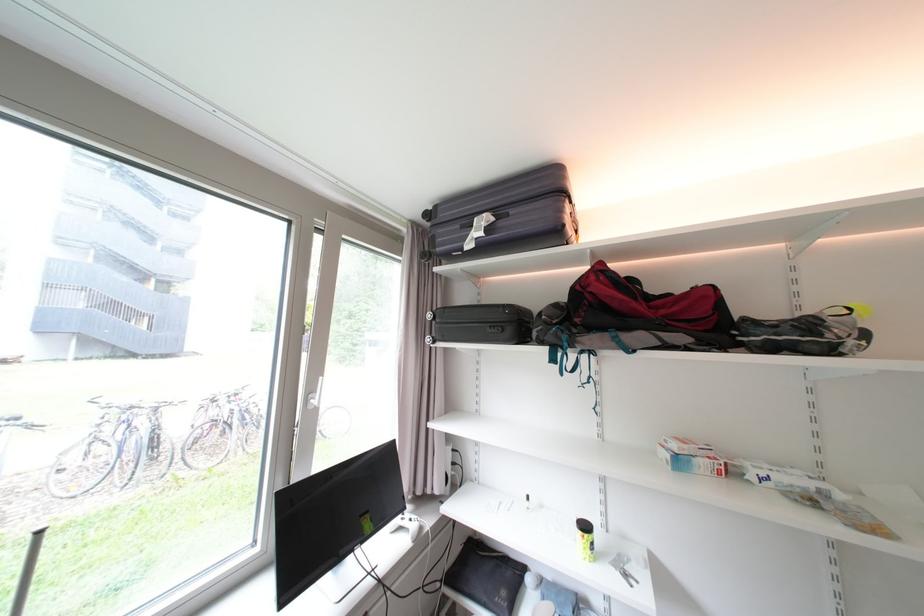
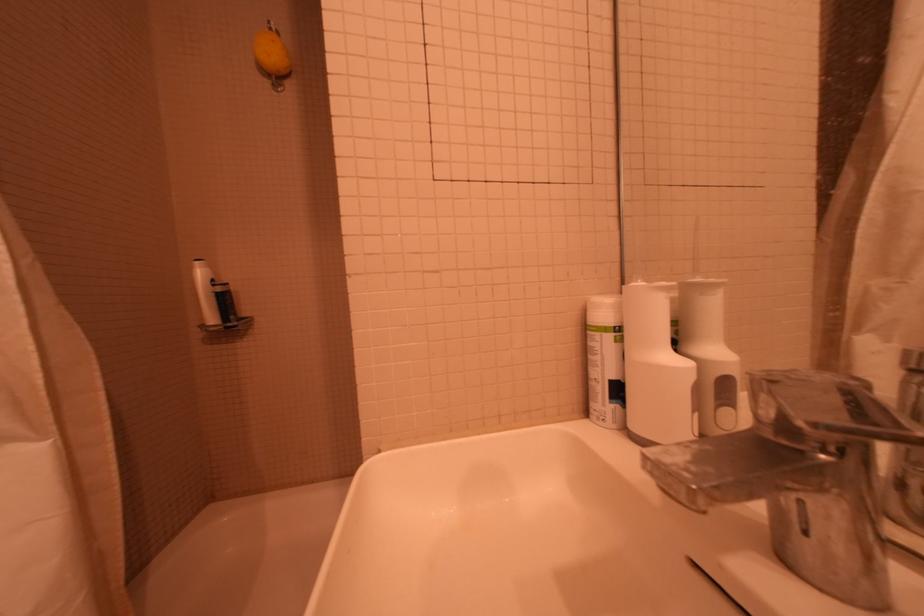
Question: I am providing you with two images of the same scene from different viewpoints. After the viewpoint changes to image2, which objects are now occluded?

Choices:
 (A) yellow tennis ball can
 (B) yellow sponge
 (C) black pyramid object
 (D) metal faucet handle

Answer: (A)